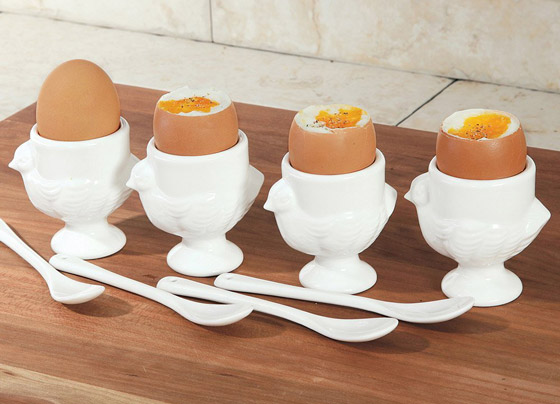
At what (x,y) coordinates should I click in order to perform the action: click on white spoons. Please return your answer as a coordinate pair (x, y). This screenshot has width=560, height=404. Looking at the image, I should click on (417, 302), (344, 334), (207, 311), (65, 293).